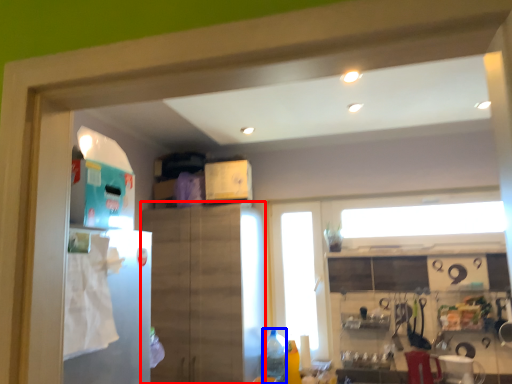
Question: Which point is closer to the camera, cabinetry (highlighted by a red box) or bottle (highlighted by a blue box)?

Choices:
 (A) cabinetry
 (B) bottle

Answer: (A)